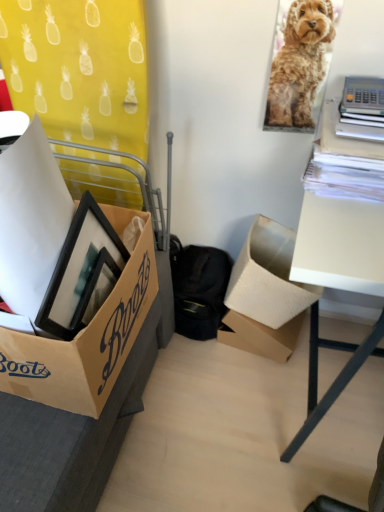
Question: In the image, is white matte table at right on the left side or the right side of golden fur dog at upper right?

Choices:
 (A) left
 (B) right

Answer: (B)

Question: From the image's perspective, is white matte table at right positioned above or below golden fur dog at upper right?

Choices:
 (A) above
 (B) below

Answer: (B)

Question: Which object is positioned farthest from the golden fur dog at upper right?

Choices:
 (A) white matte table at right
 (B) cardboard box at lower right, which is the 1th box in right-to-left order
 (C) brown cardboard box at lower left, positioned as the 3th box in right-to-left order
 (D) brown cardboard box at center, the second box positioned from the left

Answer: (D)

Question: Which of these objects is positioned farthest from the golden fur dog at upper right?

Choices:
 (A) brown cardboard box at lower left, positioned as the 3th box in right-to-left order
 (B) cardboard box at lower right, the third box viewed from the left
 (C) white matte table at right
 (D) brown cardboard box at center, the second box positioned from the left

Answer: (D)